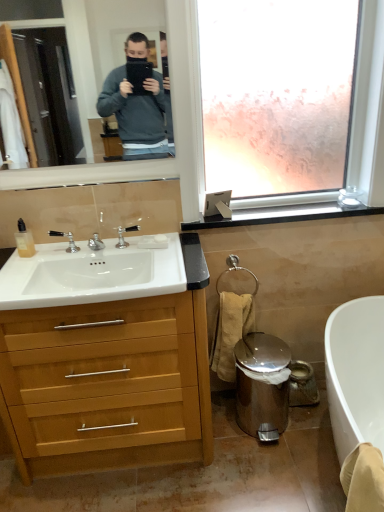
Identify the location of vacant space in front of translucent plastic bottle at sink left. (16, 267).